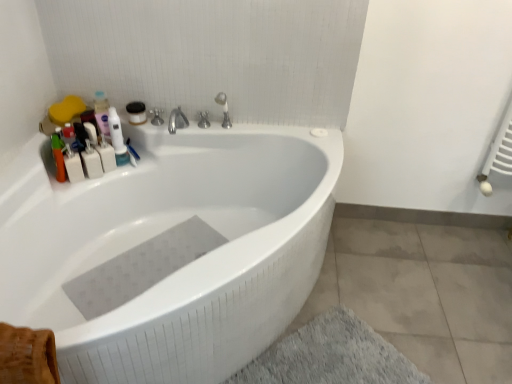
Image resolution: width=512 pixels, height=384 pixels. Describe the element at coordinates (331, 356) in the screenshot. I see `gray soft bath mat at lower right` at that location.

This screenshot has width=512, height=384. Describe the element at coordinates (106, 155) in the screenshot. I see `white plastic mouthwash at upper left, the second mouthwash when ordered from left to right` at that location.

How much space does white plastic mouthwash at upper left, the second mouthwash when ordered from left to right, occupy horizontally?

white plastic mouthwash at upper left, the second mouthwash when ordered from left to right, is 3.40 inches in width.

Locate an element on the screen. This screenshot has height=384, width=512. white glossy bottle at upper left is located at coordinates (118, 138).

Identify the location of gray soft bath mat at lower right. Image resolution: width=512 pixels, height=384 pixels. (331, 356).

Is gray soft bath mat at lower right oriented towards polished chrome faucet at upper center, positioned as the 2th tap in right-to-left order?

No, gray soft bath mat at lower right is not oriented towards polished chrome faucet at upper center, positioned as the 2th tap in right-to-left order.

Which is more distant, (291, 379) or (201, 117)?

Point (201, 117)

Between gray soft bath mat at lower right and polished chrome faucet at upper center, positioned as the 2th tap in right-to-left order, which one has larger size?

With larger size is gray soft bath mat at lower right.

From the image's perspective, is white glossy bottle at upper left on gray soft bath mat at lower right?

Indeed, from the image's perspective, white glossy bottle at upper left is shown above gray soft bath mat at lower right.

Is white glossy bottle at upper left looking in the opposite direction of gray soft bath mat at lower right?

That's not correct — white glossy bottle at upper left is not looking away from gray soft bath mat at lower right.

Is white glossy bottle at upper left positioned behind gray soft bath mat at lower right?

Yes, white glossy bottle at upper left is further from the camera.

Considering the points (122, 154) and (372, 380), which point is in front, point (122, 154) or point (372, 380)?

The point (372, 380) is in front.

In the scene shown: From a real-world perspective, is white glossy bathtub at upper center physically above white plastic mouthwash at upper left, positioned as the 2th mouthwash in right-to-left order?

No, from a real-world perspective, white glossy bathtub at upper center is not over white plastic mouthwash at upper left, positioned as the 2th mouthwash in right-to-left order

Is white glossy bathtub at upper center in front of or behind white plastic mouthwash at upper left, positioned as the 2th mouthwash in right-to-left order, in the image?

In the image, white glossy bathtub at upper center appears in front of white plastic mouthwash at upper left, positioned as the 2th mouthwash in right-to-left order.

From the image's perspective, is white glossy bathtub at upper center located above or below white plastic mouthwash at upper left, which ranks as the first mouthwash in left-to-right order?

Clearly, from the image's perspective, white glossy bathtub at upper center is below white plastic mouthwash at upper left, which ranks as the first mouthwash in left-to-right order.

The image size is (512, 384). Find the location of `bath mat below the gray rubber mat at bottom (from the image's perspective)`. bath mat below the gray rubber mat at bottom (from the image's perspective) is located at coordinates point(331,356).

In the image, is gray soft bath mat at lower right positioned in front of or behind gray rubber mat at bottom?

gray soft bath mat at lower right is positioned closer to the viewer than gray rubber mat at bottom.

Which of these two, gray soft bath mat at lower right or gray rubber mat at bottom, is thinner?

With smaller width is gray rubber mat at bottom.

Would you say gray rubber mat at bottom is part of gray soft bath mat at lower right's contents?

No, gray rubber mat at bottom is located outside of gray soft bath mat at lower right.

Is white plastic bottles at upper left at the back of white glossy bottle at upper left?

No.

Do you think white glossy bottle at upper left is within white plastic bottles at upper left, or outside of it?

white glossy bottle at upper left exists outside the volume of white plastic bottles at upper left.

Considering the relative sizes of white glossy bottle at upper left and white plastic bottles at upper left in the image provided, is white glossy bottle at upper left bigger than white plastic bottles at upper left?

Yes.

From a real-world perspective, is white glossy bottle at upper left positioned under white plastic bottles at upper left based on gravity?

Incorrect, from a real-world perspective, white glossy bottle at upper left is higher than white plastic bottles at upper left.

Which of these two, gray soft bath mat at lower right or white plastic bottles at upper left, is wider?

gray soft bath mat at lower right is wider.

Visually, is gray soft bath mat at lower right positioned to the left or to the right of white plastic bottles at upper left?

gray soft bath mat at lower right is positioned on white plastic bottles at upper left's right side.

Which is closer, (x=337, y=349) or (x=80, y=160)?

The point (x=337, y=349) is closer to the camera.

From the image's perspective, which is below, gray soft bath mat at lower right or white plastic bottles at upper left?

gray soft bath mat at lower right, from the image's perspective.

Considering the sizes of objects satin nickel faucet at upper center, the first tap from the right, and white plastic mouthwash at upper left, which ranks as the 1th mouthwash in right-to-left order, in the image provided, who is shorter, satin nickel faucet at upper center, the first tap from the right, or white plastic mouthwash at upper left, which ranks as the 1th mouthwash in right-to-left order,?

white plastic mouthwash at upper left, which ranks as the 1th mouthwash in right-to-left order.

Is satin nickel faucet at upper center, the first tap from the right, to the right of white plastic mouthwash at upper left, the second mouthwash when ordered from left to right, from the viewer's perspective?

Yes, satin nickel faucet at upper center, the first tap from the right, is to the right of white plastic mouthwash at upper left, the second mouthwash when ordered from left to right.

Is satin nickel faucet at upper center, the first tap from the right, aimed at white plastic mouthwash at upper left, which ranks as the 1th mouthwash in right-to-left order?

No, satin nickel faucet at upper center, the first tap from the right, does not turn towards white plastic mouthwash at upper left, which ranks as the 1th mouthwash in right-to-left order.

The image size is (512, 384). In order to click on bath mat in front of the polished chrome faucet at upper center, placed as the first tap when sorted from left to right in this screenshot , I will do `click(331, 356)`.

Find the location of a particular element. This screenshot has height=384, width=512. bath mat below the white glossy bottle at upper left (from the image's perspective) is located at coordinates (331, 356).

Which object lies nearer to the anchor point gray soft bath mat at lower right, white plastic mouthwash at upper left, which ranks as the 1th mouthwash in right-to-left order, or white plastic bottles at upper left?

white plastic mouthwash at upper left, which ranks as the 1th mouthwash in right-to-left order, is positioned closer to the anchor gray soft bath mat at lower right.

Which object lies nearer to the anchor point white plastic bottles at upper left, polished chrome faucet at upper center, positioned as the 2th tap in right-to-left order, or white plastic mouthwash at upper left, the second mouthwash when ordered from left to right?

Based on the image, white plastic mouthwash at upper left, the second mouthwash when ordered from left to right, appears to be nearer to white plastic bottles at upper left.

Which object lies nearer to the anchor point white glossy bottle at upper left, white plastic mouthwash at upper left, which ranks as the 1th mouthwash in right-to-left order, or satin nickel faucet at upper center, the first tap from the right?

white plastic mouthwash at upper left, which ranks as the 1th mouthwash in right-to-left order, is positioned closer to the anchor white glossy bottle at upper left.

Which object lies nearer to the anchor point white plastic mouthwash at upper left, which ranks as the first mouthwash in left-to-right order, gray rubber mat at bottom or white plastic mouthwash at upper left, which ranks as the 1th mouthwash in right-to-left order?

white plastic mouthwash at upper left, which ranks as the 1th mouthwash in right-to-left order, lies closer to white plastic mouthwash at upper left, which ranks as the first mouthwash in left-to-right order, than the other object.

When comparing their distances from gray soft bath mat at lower right, does white glossy bottle at upper left or polished chrome faucet at upper center, positioned as the 2th tap in right-to-left order, seem further?

The object further to gray soft bath mat at lower right is white glossy bottle at upper left.

Considering their positions, is white plastic mouthwash at upper left, positioned as the 2th mouthwash in right-to-left order, positioned further to polished chrome faucet at upper center, placed as the first tap when sorted from left to right, than gray rubber mat at bottom?

gray rubber mat at bottom is positioned further to the anchor polished chrome faucet at upper center, placed as the first tap when sorted from left to right.

Consider the image. Considering their positions, is gray rubber mat at bottom positioned closer to gray soft bath mat at lower right than white plastic bottles at upper left?

gray rubber mat at bottom is positioned closer to the anchor gray soft bath mat at lower right.

Based on their spatial positions, is gray soft bath mat at lower right or white glossy bathtub at upper center further from gray rubber mat at bottom?

gray soft bath mat at lower right.

You are a GUI agent. You are given a task and a screenshot of the screen. Output one action in this format:
    pyautogui.click(x=<x>, y=<y>)
    Task: Click on the tap situated between white plastic mouthwash at upper left, positioned as the 2th mouthwash in right-to-left order, and satin nickel faucet at upper center, the first tap from the right, from left to right
    
    Given the screenshot: What is the action you would take?
    tap(203, 120)

Locate an element on the screen. toiletry positioned between white glossy bathtub at upper center and satin nickel faucet at upper center, the first tap from the right, from near to far is located at coordinates (73, 165).

The height and width of the screenshot is (384, 512). In order to click on cleaning product between white plastic mouthwash at upper left, positioned as the 2th mouthwash in right-to-left order, and gray soft bath mat at lower right from left to right in this screenshot , I will do pos(118,138).

Locate an element on the screen. The image size is (512, 384). tap between satin nickel faucet at upper center, which appears as the second tap when viewed from the left, and gray rubber mat at bottom in the up-down direction is located at coordinates (203, 120).